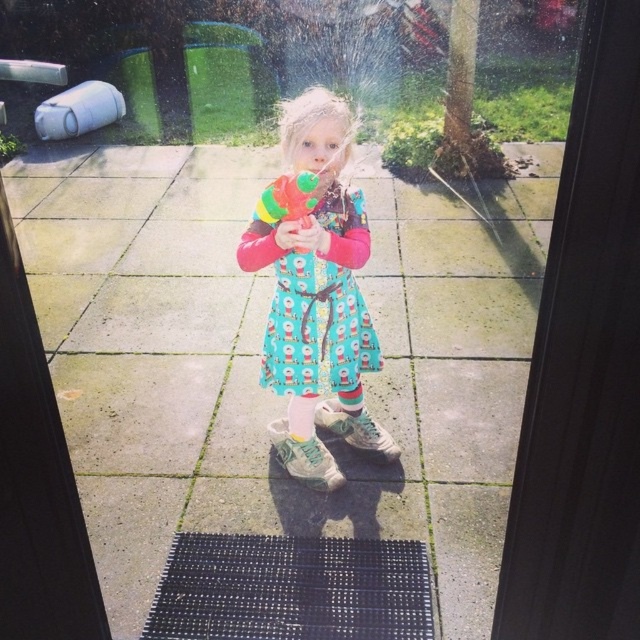
Question: Which of these objects is positioned farthest from the cotton dress at center?

Choices:
 (A) rubberized plastic water gun at center
 (B) transparent glass screen door at upper right

Answer: (B)

Question: Observing the image, what is the correct spatial positioning of transparent glass screen door at upper right in reference to rubberized plastic water gun at center?

Choices:
 (A) right
 (B) left

Answer: (A)

Question: Based on their relative distances, which object is nearer to the rubberized plastic water gun at center?

Choices:
 (A) turquoise fabric dress at center
 (B) transparent glass screen door at upper right
 (C) cotton dress at center

Answer: (C)

Question: Can you confirm if transparent glass screen door at upper right is positioned to the right of rubberized plastic water gun at center?

Choices:
 (A) no
 (B) yes

Answer: (B)

Question: Can you confirm if turquoise fabric dress at center is positioned to the left of rubberized plastic water gun at center?

Choices:
 (A) yes
 (B) no

Answer: (B)

Question: Which of these objects is positioned closest to the rubberized plastic water gun at center?

Choices:
 (A) transparent glass screen door at upper right
 (B) turquoise fabric dress at center
 (C) cotton dress at center

Answer: (C)